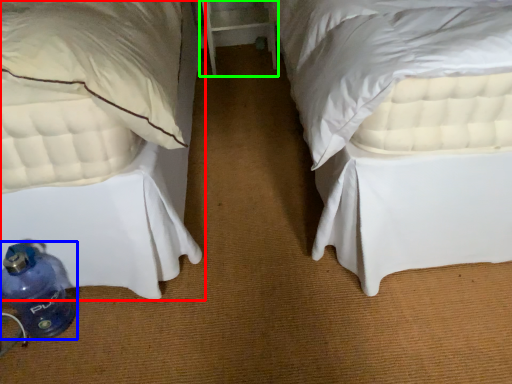
Question: Which object is positioned farthest from bed (highlighted by a red box)? Select from bottle (highlighted by a blue box) and table (highlighted by a green box).

Choices:
 (A) bottle
 (B) table

Answer: (B)